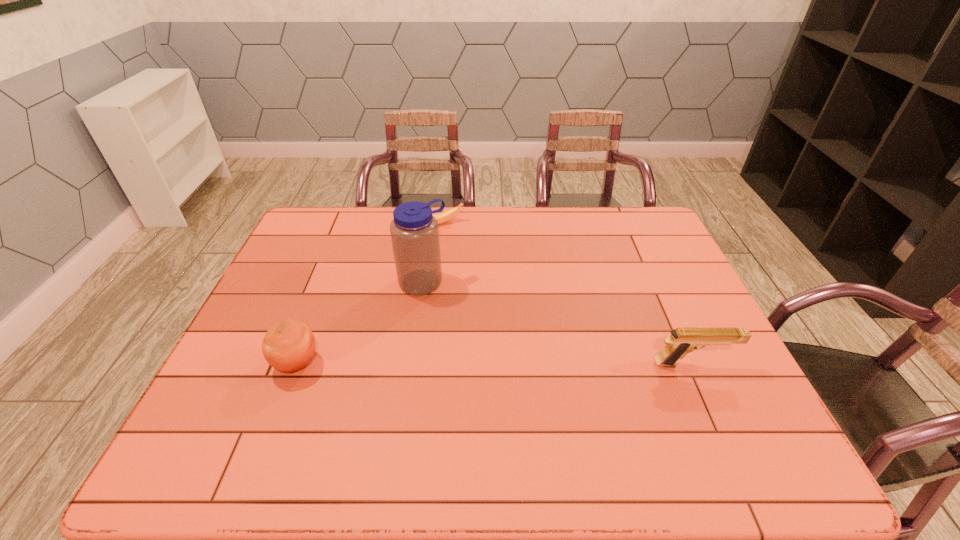
Find the location of a particular element. orange is located at coordinates (288, 346).

Find the location of a particular element. the rightmost object is located at coordinates (683, 340).

This screenshot has width=960, height=540. Identify the location of banana. (443, 217).

The image size is (960, 540). I want to click on the shortest object, so click(443, 217).

Locate an element on the screen. Image resolution: width=960 pixels, height=540 pixels. water bottle is located at coordinates (414, 230).

Where is `the tallest object`? This screenshot has width=960, height=540. the tallest object is located at coordinates (414, 230).

You are a GUI agent. You are given a task and a screenshot of the screen. Output one action in this format:
    pyautogui.click(x=<x>, y=<y>)
    Task: Click on the vacant area situated 0.360m on the right of the orange
    Image resolution: width=960 pixels, height=540 pixels.
    Given the screenshot: What is the action you would take?
    point(466,363)

The image size is (960, 540). Find the location of `vacant area situated at the stem of the farthest object`. vacant area situated at the stem of the farthest object is located at coordinates (506, 298).

Locate an element on the screen. free space located 0.190m at the stem of the farthest object is located at coordinates (476, 263).

What are the coordinates of `vacant region located at the stem of the farthest object` in the screenshot? It's located at (497, 288).